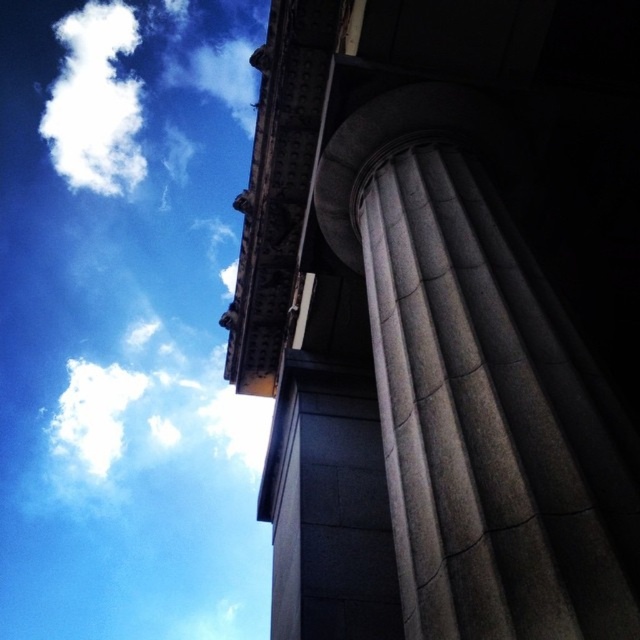
You are standing at the center of the image and want to locate the gray stone column at upper right. According to the coordinates provided, where exactly is it positioned?

The gray stone column at upper right is positioned at coordinates point (x=445, y=316).

You are standing at the base of the building depicted in the image. Looking upward, you notice the gray stone column at upper right and the white fluffy cloud at upper left. Which object appears closer to the top of the image?

The white fluffy cloud at upper left appears closer to the top of the image because the gray stone column at upper right is located below it.

You are standing below the classical building and looking up. You notice the gray stone column at upper right and the white fluffy cloud at upper left. Which object is positioned more to the right side of your view?

The gray stone column at upper right is positioned more to the right side of your view compared to the white fluffy cloud at upper left.